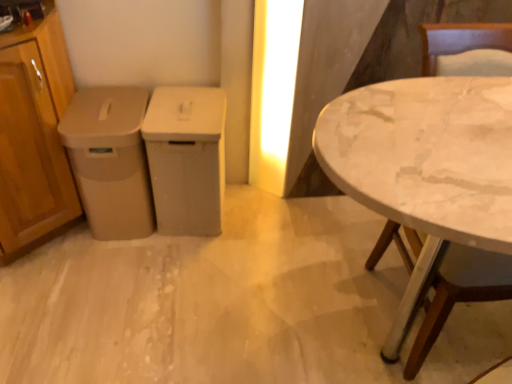
Where is `free space above beige plastic trash can at left, which is counted as the 2th cabinetry, starting from the right (from a real-world perspective)`? Image resolution: width=512 pixels, height=384 pixels. free space above beige plastic trash can at left, which is counted as the 2th cabinetry, starting from the right (from a real-world perspective) is located at coordinates (114, 112).